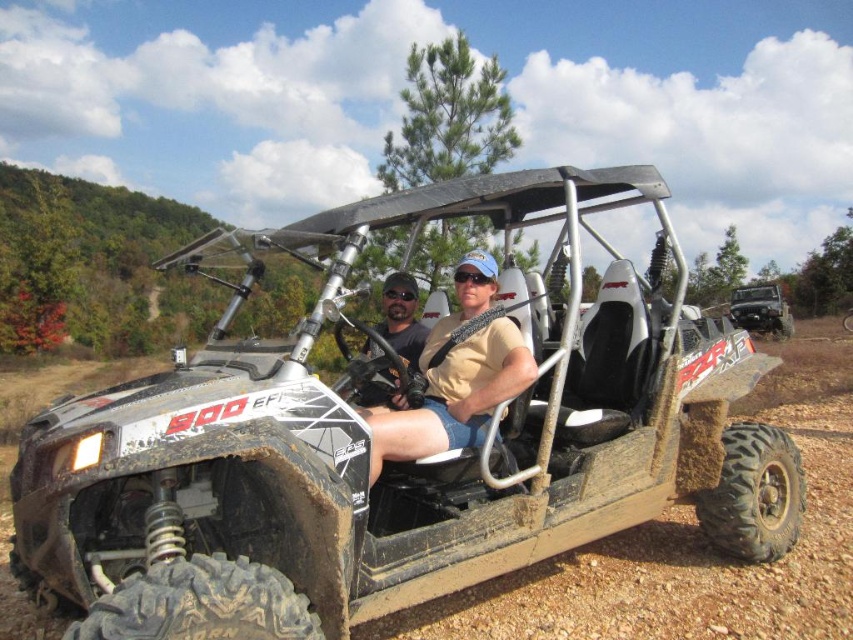
Can you confirm if matte black golf cart at center is positioned to the left of matte black helmet at center?

Incorrect, matte black golf cart at center is not on the left side of matte black helmet at center.

Identify the location of matte black golf cart at center. [x=397, y=440].

Between point (102, 468) and point (424, 326), which one is positioned behind?

Point (424, 326)

Find the location of a particular element. Image resolution: width=853 pixels, height=640 pixels. matte black golf cart at center is located at coordinates (397, 440).

In the scene shown: Is matte black golf cart at center positioned before tan fabric shirt at center?

That is True.

Does matte black golf cart at center have a greater width compared to tan fabric shirt at center?

Yes, matte black golf cart at center is wider than tan fabric shirt at center.

Identify the location of matte black golf cart at center. (397, 440).

Identify the location of matte black golf cart at center. The height and width of the screenshot is (640, 853). (397, 440).

Can you confirm if tan fabric shirt at center is thinner than brushed metal jeep at center?

No.

Between tan fabric shirt at center and brushed metal jeep at center, which one has less height?

With less height is brushed metal jeep at center.

Locate an element on the screen. This screenshot has height=640, width=853. tan fabric shirt at center is located at coordinates (456, 376).